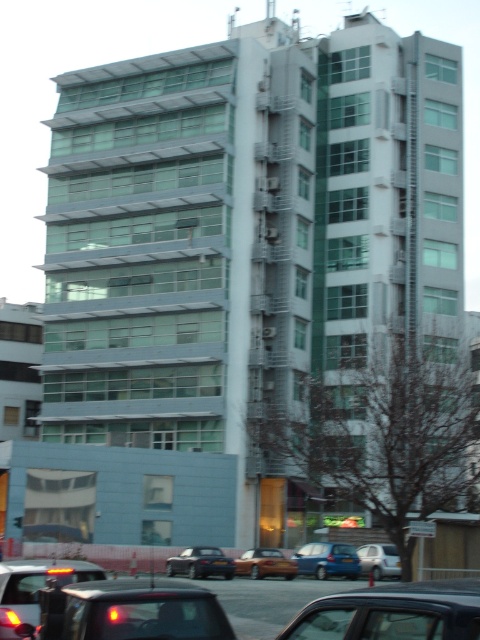
You are standing in front of the building and notice a black glossy car at lower center and a black plastic license plate at center. Which object is nearer to you?

The black glossy car at lower center is closer to the viewer than the black plastic license plate at center.

You are standing in front of the building and want to reach the point marked as point (192, 628) and point (228, 566). Which point is closer to you?

Point (192, 628) is closer to the viewer than point (228, 566).